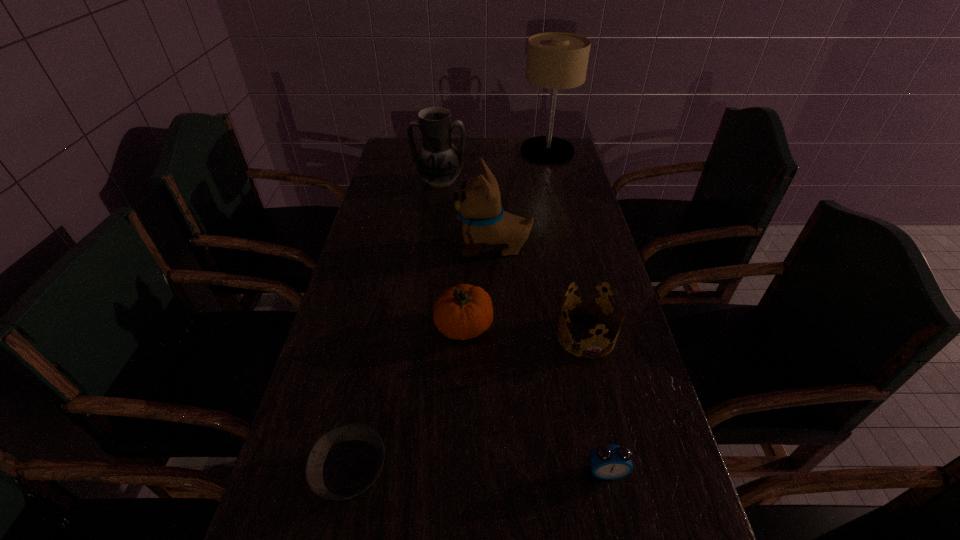
This screenshot has height=540, width=960. I want to click on vacant space that's between the bowl and the crown, so click(x=468, y=403).

Where is `free area in between the shortest object and the third farthest object`? The height and width of the screenshot is (540, 960). free area in between the shortest object and the third farthest object is located at coordinates (422, 360).

Identify the location of empty space that is in between the fifth tallest object and the second shortest object. The image size is (960, 540). (596, 403).

This screenshot has width=960, height=540. I want to click on free space between the bowl and the third farthest object, so [422, 360].

Locate which object ranks third in proximity to the sixth tallest object. Please provide its 2D coordinates. Your answer should be formatted as a tuple, i.e. [(x, y)], where the tuple contains the x and y coordinates of a point satisfying the conditions above.

[(344, 462)]

In order to click on object that is the sixth nearest to the sixth tallest object in this screenshot , I will do `click(555, 60)`.

Locate an element on the screen. free location that satisfies the following two spatial constraints: 1. on the front-facing side of the fifth tallest object; 2. on the left side of the pitcher is located at coordinates (420, 335).

Find the location of a particular element. The height and width of the screenshot is (540, 960). free space that satisfies the following two spatial constraints: 1. on the face of the third farthest object; 2. on the left side of the crown is located at coordinates (496, 335).